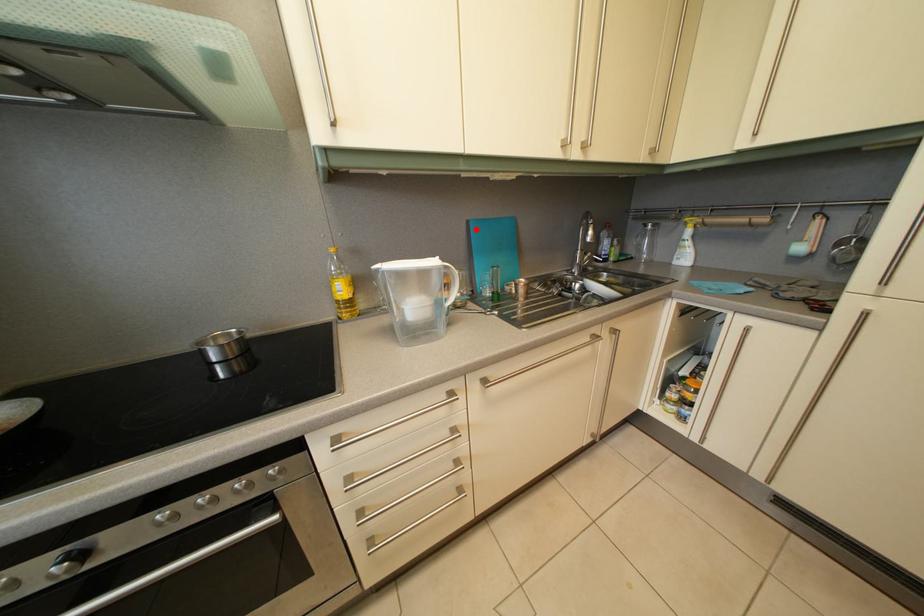
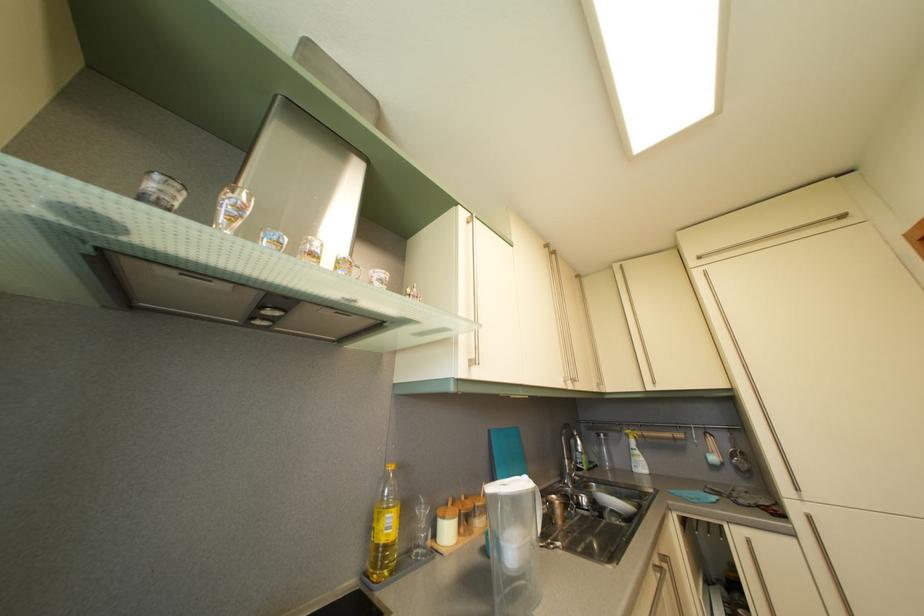
In the second image, find the point that corresponds to the highlighted location in the first image.

(497, 439)